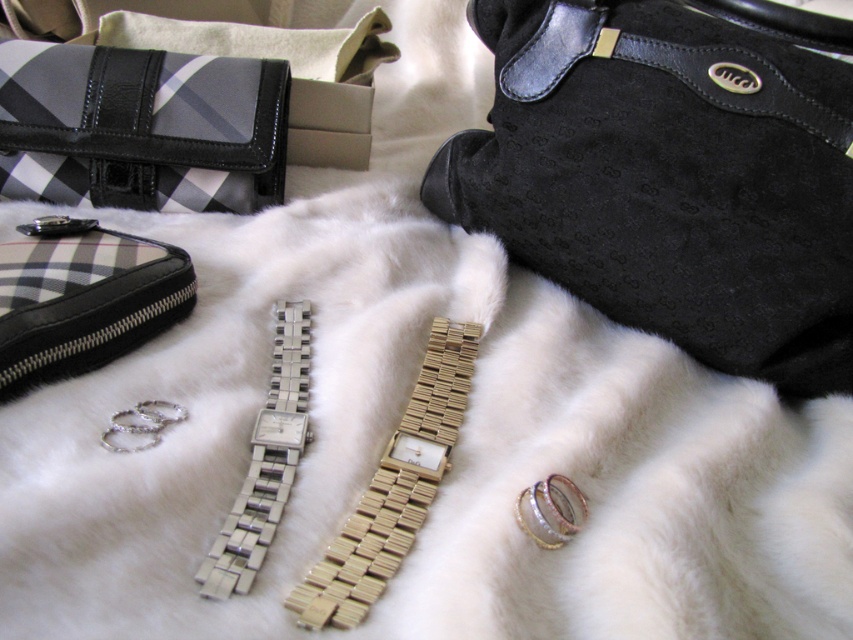
Can you confirm if black checkered fabric wallet at upper left is smaller than silver metallic watch at center?

Incorrect, black checkered fabric wallet at upper left is not smaller in size than silver metallic watch at center.

Who is taller, black checkered fabric wallet at upper left or silver metallic watch at center?

silver metallic watch at center is taller.

Who is more forward, (15,376) or (260,433)?

Positioned in front is point (260,433).

Locate an element on the screen. black checkered fabric wallet at upper left is located at coordinates (82, 298).

Who is more distant from viewer, (119, 284) or (761, 77)?

The point (761, 77) is more distant.

Between black checkered fabric wallet at upper left and suede leather strap at upper right, which one is positioned lower?

Positioned lower is black checkered fabric wallet at upper left.

Locate an element on the screen. The height and width of the screenshot is (640, 853). black checkered fabric wallet at upper left is located at coordinates (82, 298).

Between black leather wallet at upper left and suede leather strap at upper right, which one appears on the left side from the viewer's perspective?

From the viewer's perspective, black leather wallet at upper left appears more on the left side.

Who is more distant from viewer, (0, 154) or (744, 100)?

The point (0, 154) is behind.

The height and width of the screenshot is (640, 853). Describe the element at coordinates (140, 128) in the screenshot. I see `black leather wallet at upper left` at that location.

Locate an element on the screen. black leather wallet at upper left is located at coordinates (140, 128).